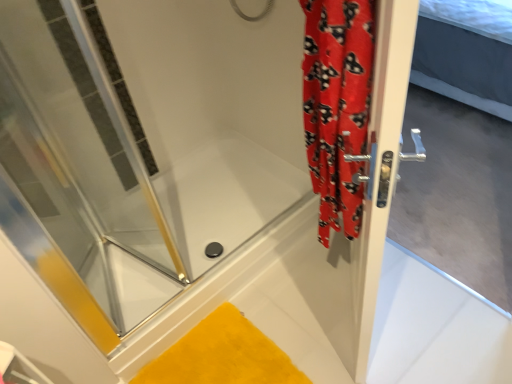
Question: Is yellow plush bath mat at lower center in front of or behind red fabric shower curtain at right in the image?

Choices:
 (A) behind
 (B) front

Answer: (A)

Question: Considering the relative positions of yellow plush bath mat at lower center and red fabric shower curtain at right in the image provided, is yellow plush bath mat at lower center to the left or to the right of red fabric shower curtain at right?

Choices:
 (A) right
 (B) left

Answer: (B)

Question: Considering the real-world distances, which object is farthest from the red fabric shower curtain at right?

Choices:
 (A) silver metallic door handle at right
 (B) transparent glass shower door at left
 (C) yellow plush bath mat at lower center

Answer: (B)

Question: Which of these objects is positioned closest to the red fabric shower curtain at right?

Choices:
 (A) silver metallic door handle at right
 (B) transparent glass shower door at left
 (C) yellow plush bath mat at lower center

Answer: (A)